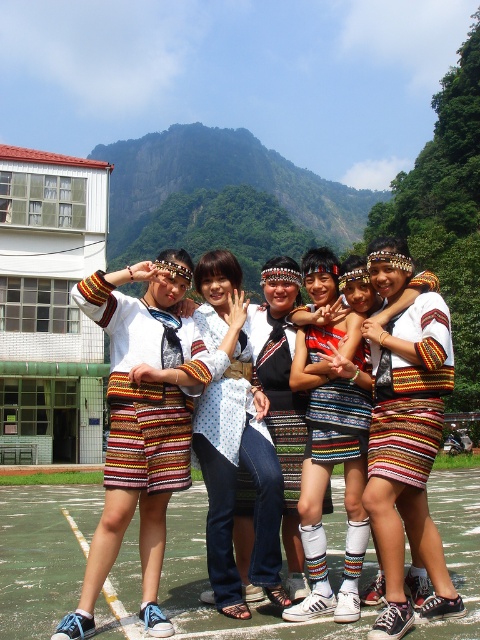
Question: Which point is closer to the camera?

Choices:
 (A) (238, 298)
 (B) (349, 506)

Answer: (B)

Question: Can you confirm if white dotted shirt at center is positioned above knitted multicolored skirt at center?

Choices:
 (A) yes
 (B) no

Answer: (B)

Question: Is white dotted shirt at center positioned in front of knitted multicolored skirt at center?

Choices:
 (A) no
 (B) yes

Answer: (A)

Question: Can you confirm if white dotted shirt at center is positioned to the left of knitted multicolored skirt at center?

Choices:
 (A) yes
 (B) no

Answer: (A)

Question: Which object is farther from the camera taking this photo?

Choices:
 (A) white dotted shirt at center
 (B) knitted multicolored skirt at center

Answer: (A)

Question: Which point is farther to the camera?

Choices:
 (A) knitted multicolored skirt at center
 (B) white dotted shirt at center

Answer: (B)